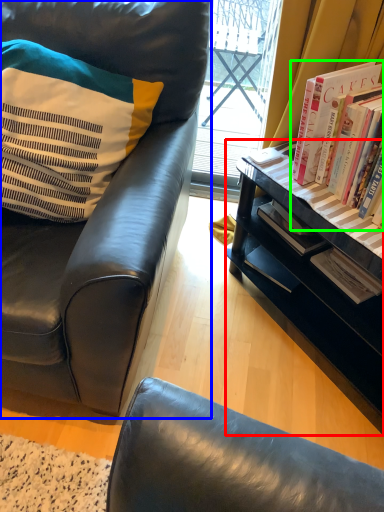
Question: Estimate the real-world distances between objects in this image. Which object is farther from desk (highlighted by a red box), chair (highlighted by a blue box) or book (highlighted by a green box)?

Choices:
 (A) chair
 (B) book

Answer: (A)